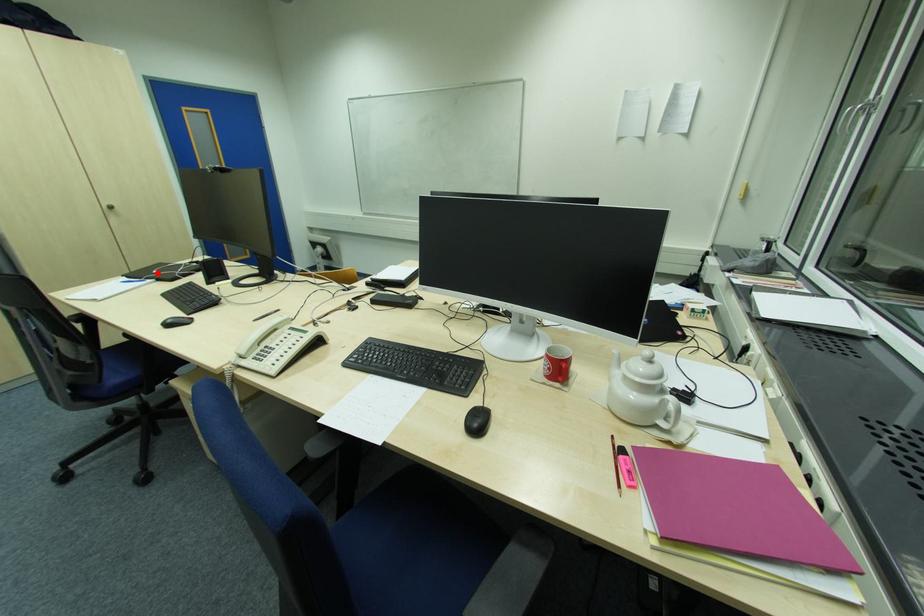
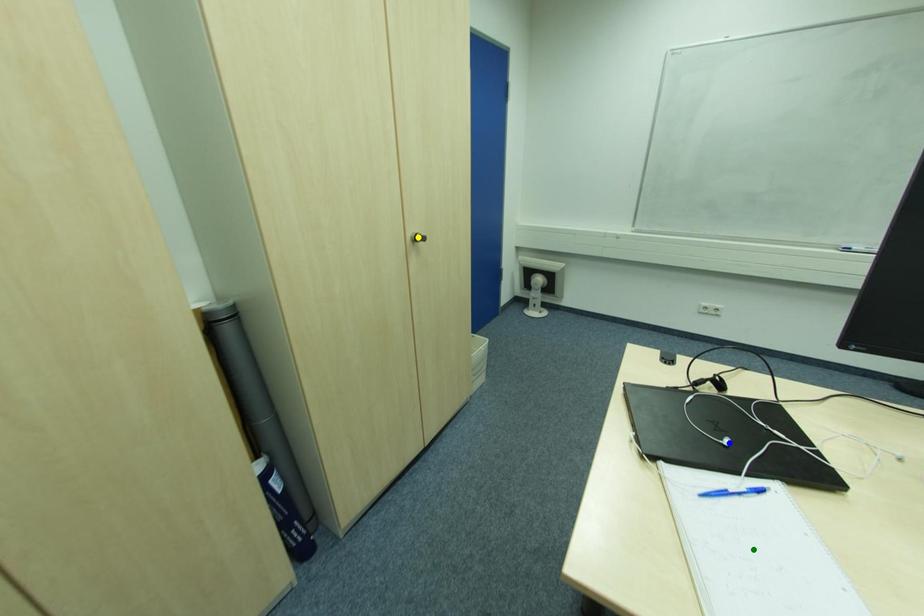
Question: I am providing you with two images of the same scene from different viewpoints. A red point is marked on the first image. You are given multiple points on the second image. Which point in image 2 is actually the same real-world point as the red point in image 1?

Choices:
 (A) blue point
 (B) yellow point
 (C) green point

Answer: (A)